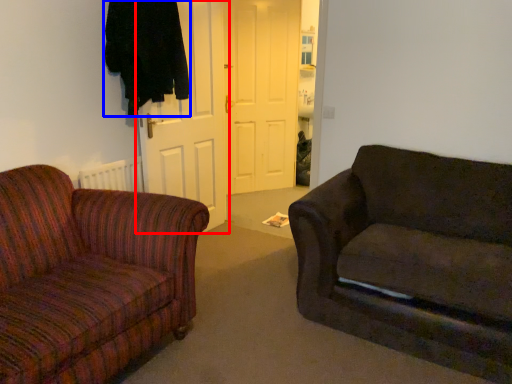
Question: Among these objects, which one is farthest to the camera, door (highlighted by a red box) or clothing (highlighted by a blue box)?

Choices:
 (A) door
 (B) clothing

Answer: (A)